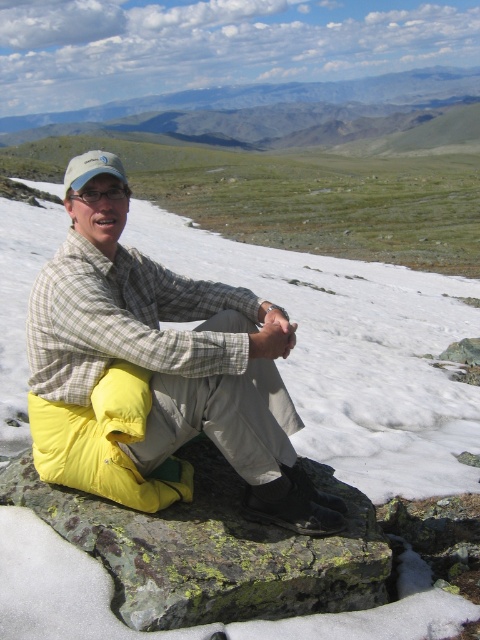
You are a hiker trying to navigate between two points marked in the image. The first point is at coordinates point [48,435] and the second point is at point [163,560]. Which point is closer to you as you stand at the starting position?

Point [48,435] is closer to you than point [163,560] because it is further to the viewer.

You are planning to place a small tent for a hiker. Given the available space, which location between the green mossy rock at center and the green grassy plain at upper center would be more suitable for setting up the tent?

The green grassy plain at upper center is more suitable for setting up the tent because it occupies more space than the green mossy rock at center.

A hiker is standing at the origin point of the coordinate system. They want to place a GPS marker exactly at the center of the green mossy rock at center. What coordinates should they input into their GPS device?

A: The coordinates for the green mossy rock at center are 0.858 on the x axis and 0.446 on the y axis. The hiker should input these coordinates into their GPS device to place the marker at the center of the green mossy rock at center.